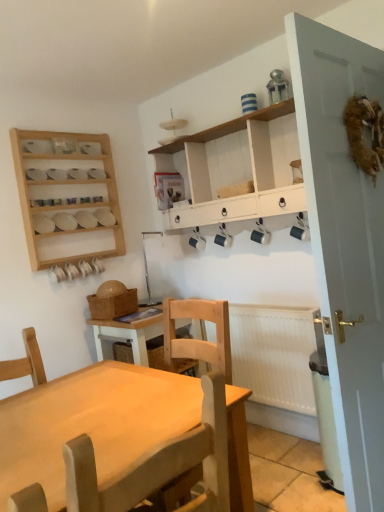
Question: Considering the relative sizes of white painted door at right and light brown wooden chair at center in the image provided, is white painted door at right taller than light brown wooden chair at center?

Choices:
 (A) no
 (B) yes

Answer: (B)

Question: Is white painted door at right completely or partially outside of light brown wooden chair at center?

Choices:
 (A) yes
 (B) no

Answer: (A)

Question: Can you confirm if white painted door at right is smaller than light brown wooden chair at center?

Choices:
 (A) yes
 (B) no

Answer: (B)

Question: Is white painted door at right aimed at light brown wooden chair at center?

Choices:
 (A) no
 (B) yes

Answer: (A)

Question: Is white painted door at right positioned in front of light brown wooden chair at center?

Choices:
 (A) no
 (B) yes

Answer: (A)

Question: Is point (231, 354) closer or farther from the camera than point (291, 211)?

Choices:
 (A) closer
 (B) farther

Answer: (B)

Question: In the image, is white matte radiator at lower right positioned in front of or behind white painted wood cabinet at upper center?

Choices:
 (A) front
 (B) behind

Answer: (B)

Question: Looking at their shapes, would you say white matte radiator at lower right is wider or thinner than white painted wood cabinet at upper center?

Choices:
 (A) wide
 (B) thin

Answer: (B)

Question: Would you say white matte radiator at lower right is to the left or to the right of white painted wood cabinet at upper center in the picture?

Choices:
 (A) left
 (B) right

Answer: (B)

Question: Is wooden spice rack at upper left in front of or behind light brown wooden chair at center in the image?

Choices:
 (A) front
 (B) behind

Answer: (B)

Question: Looking at the image, does wooden spice rack at upper left seem bigger or smaller compared to light brown wooden chair at center?

Choices:
 (A) small
 (B) big

Answer: (A)

Question: Is point (79, 162) closer or farther from the camera than point (226, 461)?

Choices:
 (A) farther
 (B) closer

Answer: (A)

Question: Is wooden spice rack at upper left inside or outside of light brown wooden chair at center?

Choices:
 (A) outside
 (B) inside

Answer: (A)

Question: From their relative heights in the image, would you say white painted wood cabinet at upper center is taller or shorter than white matte radiator at lower right?

Choices:
 (A) short
 (B) tall

Answer: (B)

Question: Considering their positions, is white painted wood cabinet at upper center located in front of or behind white matte radiator at lower right?

Choices:
 (A) front
 (B) behind

Answer: (A)